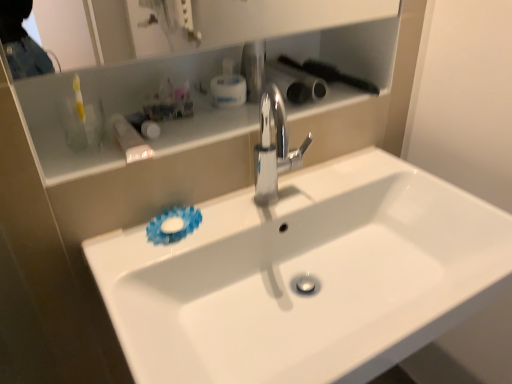
Question: From a real-world perspective, is translucent plastic container at upper left located higher than polished chrome faucet at center?

Choices:
 (A) yes
 (B) no

Answer: (A)

Question: Can you confirm if translucent plastic container at upper left is thinner than polished chrome faucet at center?

Choices:
 (A) yes
 (B) no

Answer: (B)

Question: Is polished chrome faucet at center inside translucent plastic container at upper left?

Choices:
 (A) yes
 (B) no

Answer: (B)

Question: Is translucent plastic container at upper left next to polished chrome faucet at center?

Choices:
 (A) yes
 (B) no

Answer: (B)

Question: Is translucent plastic container at upper left taller than polished chrome faucet at center?

Choices:
 (A) no
 (B) yes

Answer: (A)

Question: Relative to polished chrome faucet at center, is translucent plastic container at upper left in front or behind?

Choices:
 (A) front
 (B) behind

Answer: (B)

Question: From the image's perspective, is translucent plastic container at upper left positioned above or below polished chrome faucet at center?

Choices:
 (A) above
 (B) below

Answer: (A)

Question: Looking at their shapes, would you say translucent plastic container at upper left is wider or thinner than polished chrome faucet at center?

Choices:
 (A) wide
 (B) thin

Answer: (A)

Question: Is translucent plastic container at upper left taller or shorter than polished chrome faucet at center?

Choices:
 (A) tall
 (B) short

Answer: (B)

Question: Is translucent plastic container at upper left wider or thinner than white glossy cabinet at upper center?

Choices:
 (A) wide
 (B) thin

Answer: (A)

Question: Is point (112, 114) positioned closer to the camera than point (204, 135)?

Choices:
 (A) closer
 (B) farther

Answer: (B)

Question: In the image, is translucent plastic container at upper left positioned in front of or behind white glossy cabinet at upper center?

Choices:
 (A) behind
 (B) front

Answer: (A)

Question: Looking at the image, does translucent plastic container at upper left seem bigger or smaller compared to white glossy cabinet at upper center?

Choices:
 (A) big
 (B) small

Answer: (B)

Question: Relative to white glossy sink at center, is polished chrome faucet at center in front or behind?

Choices:
 (A) front
 (B) behind

Answer: (B)

Question: In terms of height, does polished chrome faucet at center look taller or shorter compared to white glossy sink at center?

Choices:
 (A) short
 (B) tall

Answer: (A)